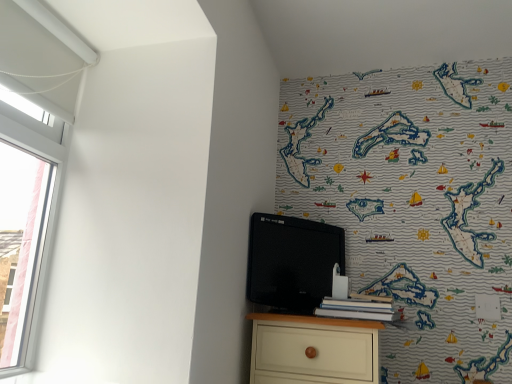
Image resolution: width=512 pixels, height=384 pixels. Find the location of `black matte tv at upper right`. black matte tv at upper right is located at coordinates (292, 262).

What do you see at coordinates (292, 262) in the screenshot? I see `black matte tv at upper right` at bounding box center [292, 262].

The image size is (512, 384). Find the location of `black matte tv at upper right`. black matte tv at upper right is located at coordinates (292, 262).